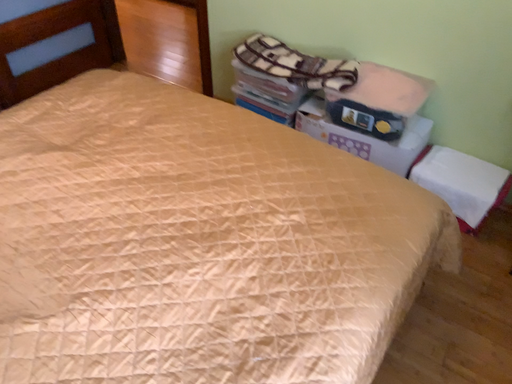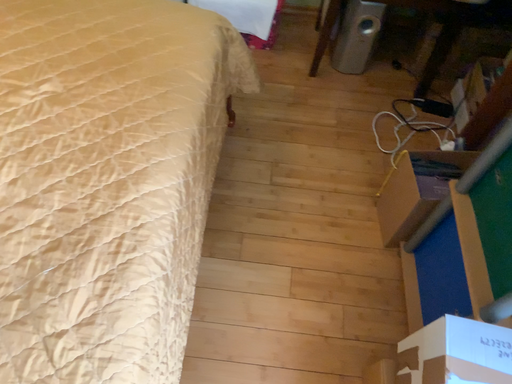
Question: How did the camera likely rotate when shooting the video?

Choices:
 (A) rotated downward
 (B) rotated upward

Answer: (A)